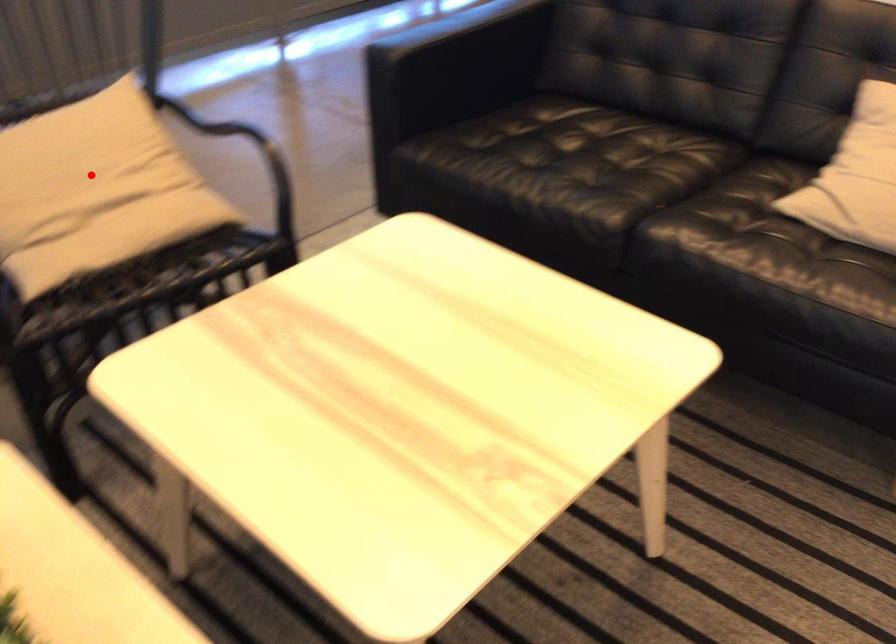
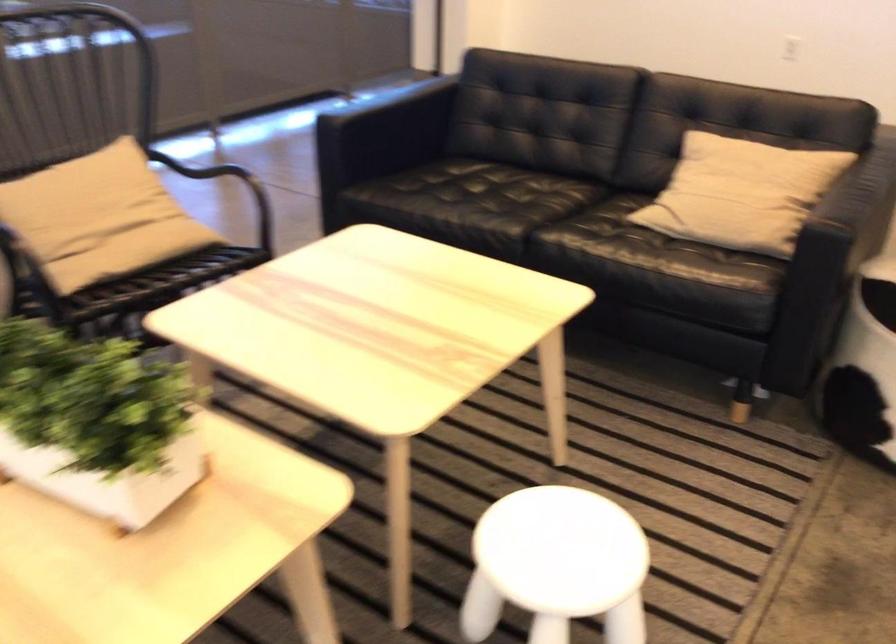
Locate, in the second image, the point that corresponds to the highlighted location in the first image.

(99, 214)